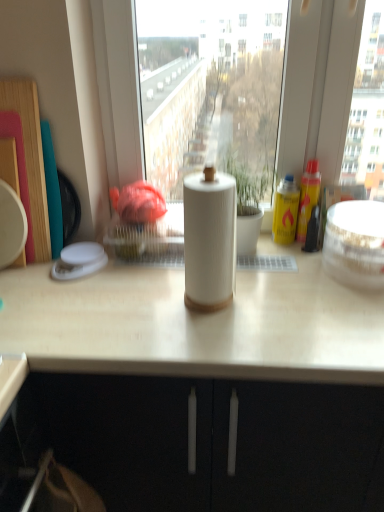
Find the location of a particular element. The height and width of the screenshot is (512, 384). vacant space that's between white matte paper towel at center and white glossy bowl at right, which is the 2th appliance from left to right is located at coordinates (285, 285).